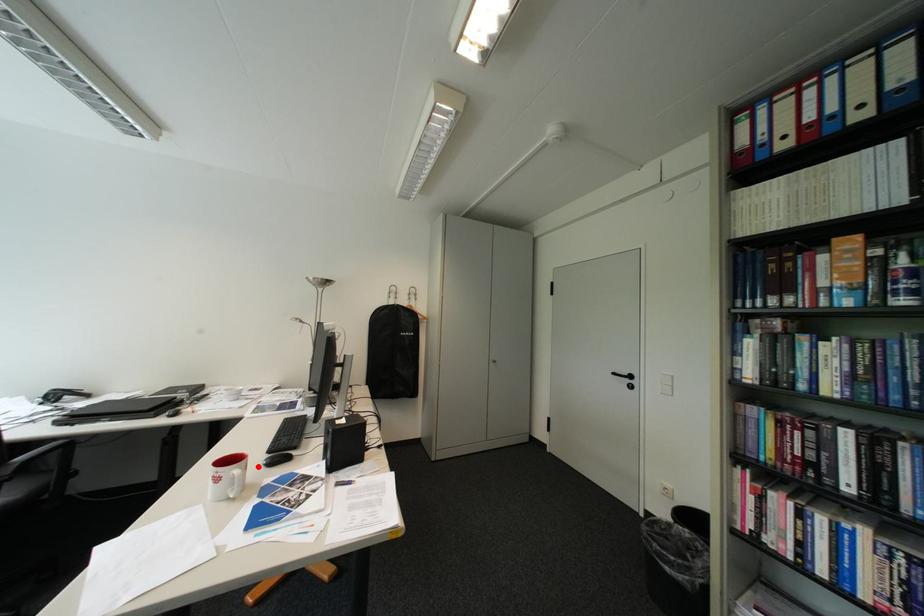
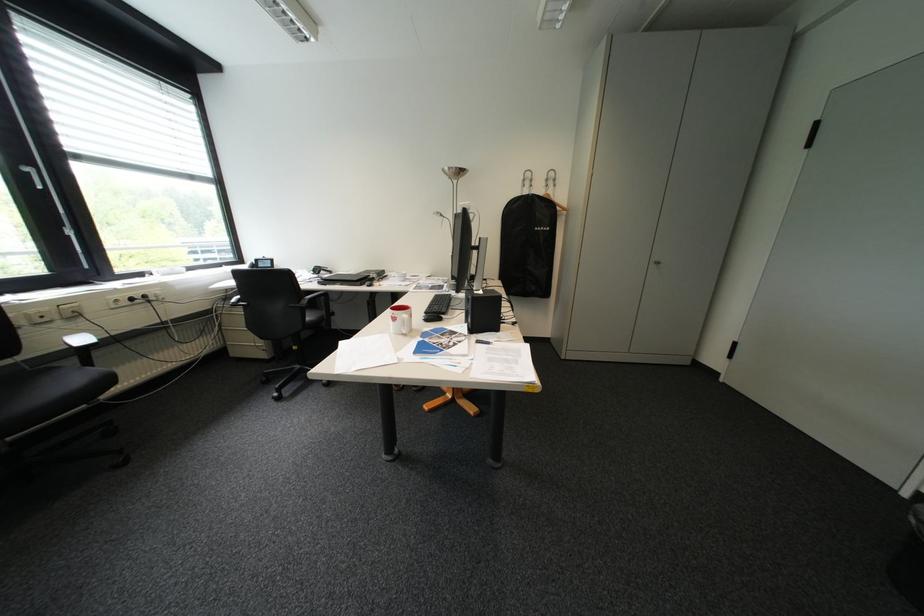
Find the pixel in the second image that matches the highlighted location in the first image.

(423, 315)